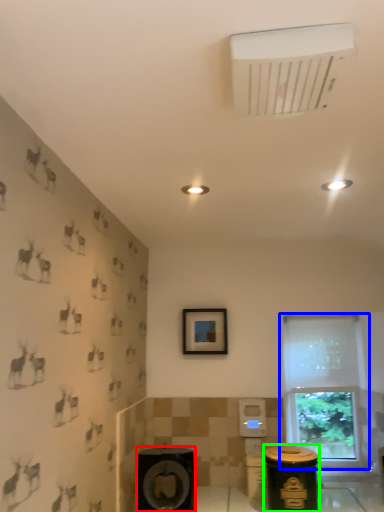
Question: Considering the real-world distances, which object is farthest from speaker (highlighted by a red box)? window (highlighted by a blue box) or garbage (highlighted by a green box)?

Choices:
 (A) window
 (B) garbage

Answer: (A)